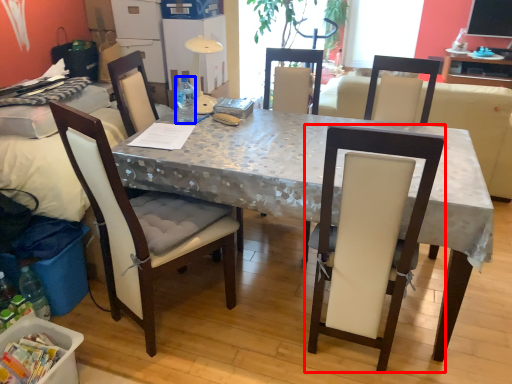
Question: Which object is further to the camera taking this photo, chair (highlighted by a red box) or bottle (highlighted by a blue box)?

Choices:
 (A) chair
 (B) bottle

Answer: (B)